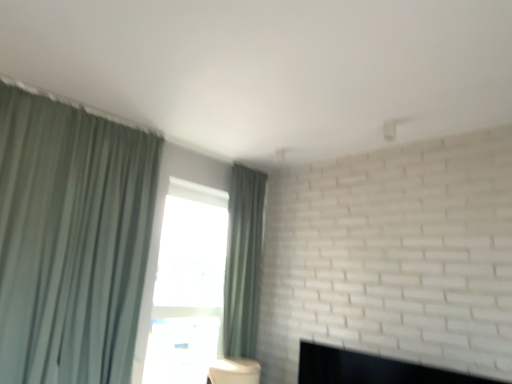
Question: Is green fabric curtain at left, positioned as the 2th curtain in back-to-front order, to the right of green fabric curtain at center, placed as the second curtain when sorted from left to right, from the viewer's perspective?

Choices:
 (A) no
 (B) yes

Answer: (A)

Question: From a real-world perspective, is green fabric curtain at left, positioned as the 2th curtain in back-to-front order, on green fabric curtain at center, which is the 1th curtain in right-to-left order?

Choices:
 (A) yes
 (B) no

Answer: (B)

Question: Does green fabric curtain at left, which is counted as the 1th curtain, starting from the left, have a lesser width compared to green fabric curtain at center, which is the 1th curtain in right-to-left order?

Choices:
 (A) no
 (B) yes

Answer: (A)

Question: Is green fabric curtain at left, positioned as the 2th curtain in back-to-front order, oriented towards green fabric curtain at center, the 1th curtain positioned from the back?

Choices:
 (A) yes
 (B) no

Answer: (B)

Question: Is green fabric curtain at left, positioned as the 2th curtain in back-to-front order, outside green fabric curtain at center, the 1th curtain positioned from the back?

Choices:
 (A) yes
 (B) no

Answer: (A)

Question: Is point (226, 355) positioned closer to the camera than point (490, 380)?

Choices:
 (A) closer
 (B) farther

Answer: (B)

Question: Is green fabric curtain at center, which is the 1th curtain in right-to-left order, taller or shorter than black matte fireplace at lower right?

Choices:
 (A) short
 (B) tall

Answer: (B)

Question: In terms of size, does green fabric curtain at center, positioned as the second curtain in front-to-back order, appear bigger or smaller than black matte fireplace at lower right?

Choices:
 (A) small
 (B) big

Answer: (B)

Question: Considering the relative positions of green fabric curtain at center, the 1th curtain positioned from the back, and black matte fireplace at lower right in the image provided, is green fabric curtain at center, the 1th curtain positioned from the back, to the left or to the right of black matte fireplace at lower right?

Choices:
 (A) left
 (B) right

Answer: (A)

Question: In terms of width, does green fabric curtain at center, positioned as the second curtain in front-to-back order, look wider or thinner when compared to green fabric curtain at left, arranged as the second curtain when viewed from the right?

Choices:
 (A) thin
 (B) wide

Answer: (A)

Question: Is green fabric curtain at center, placed as the second curtain when sorted from left to right, in front of or behind green fabric curtain at left, positioned as the 2th curtain in back-to-front order, in the image?

Choices:
 (A) front
 (B) behind

Answer: (B)

Question: From a real-world perspective, is green fabric curtain at center, the 1th curtain positioned from the back, above or below green fabric curtain at left, which is counted as the 1th curtain, starting from the left?

Choices:
 (A) below
 (B) above

Answer: (B)

Question: Is point pos(238,345) positioned closer to the camera than point pos(89,329)?

Choices:
 (A) closer
 (B) farther

Answer: (B)

Question: From their relative heights in the image, would you say black matte fireplace at lower right is taller or shorter than green fabric curtain at center, which is the 1th curtain in right-to-left order?

Choices:
 (A) short
 (B) tall

Answer: (A)

Question: Is black matte fireplace at lower right in front of or behind green fabric curtain at center, positioned as the second curtain in front-to-back order, in the image?

Choices:
 (A) behind
 (B) front

Answer: (B)